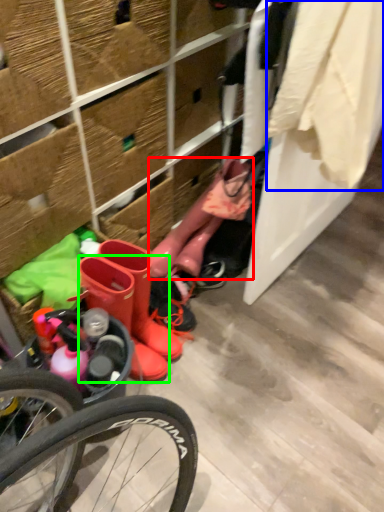
Question: Considering the real-world distances, which object is farthest from boot (highlighted by a red box)? clothing (highlighted by a blue box) or footwear (highlighted by a green box)?

Choices:
 (A) clothing
 (B) footwear

Answer: (A)